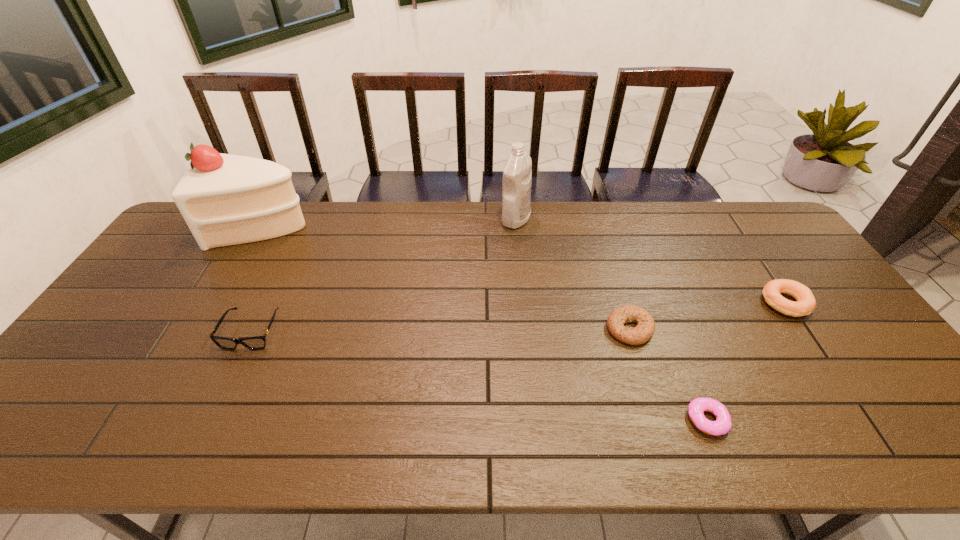
Find the location of a particular element. This screenshot has width=960, height=540. free space at the far edge of the desktop is located at coordinates (620, 223).

In the image, there is a desktop. Where is `vacant space at the left edge`? vacant space at the left edge is located at coordinates (161, 294).

The height and width of the screenshot is (540, 960). Identify the location of free region at the right edge of the desktop. (801, 255).

You are a GUI agent. You are given a task and a screenshot of the screen. Output one action in this format:
    pyautogui.click(x=<x>, y=<y>)
    Task: Click on the vacant space at the far right corner of the desktop
    The width and height of the screenshot is (960, 540).
    Given the screenshot: What is the action you would take?
    pyautogui.click(x=745, y=203)

Locate an element on the screen. The height and width of the screenshot is (540, 960). empty location between the detergent and the sunglasses is located at coordinates (384, 275).

Where is `free area in between the doughnut and the cake`? free area in between the doughnut and the cake is located at coordinates (485, 323).

Locate an element on the screen. The width and height of the screenshot is (960, 540). unoccupied position between the sunglasses and the left bagel is located at coordinates (441, 330).

Identify the location of free space between the cake and the right bagel. (524, 265).

Where is `vacant region between the cake and the shortest object`? The width and height of the screenshot is (960, 540). vacant region between the cake and the shortest object is located at coordinates (485, 323).

Identify the location of empty location between the second shortest object and the sunglasses. tap(441, 330).